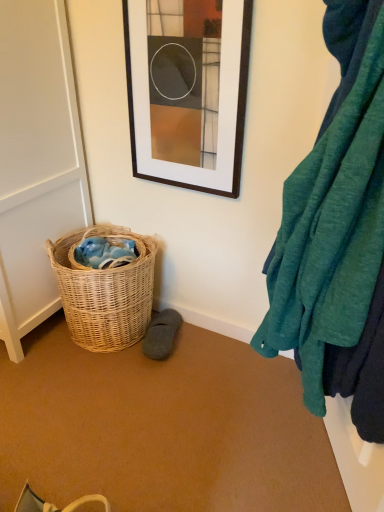
Find the location of a particular element. This screenshot has width=384, height=512. white matte screen door at left is located at coordinates (36, 161).

You are a GUI agent. You are given a task and a screenshot of the screen. Output one action in this format:
    pyautogui.click(x=<x>, y=<y>)
    Task: Click on the matte black picture frame at upper center
    The image size is (384, 512).
    Given the screenshot: What is the action you would take?
    pyautogui.click(x=188, y=90)

The image size is (384, 512). What are the coordinates of `gray suede slipper at lower center` in the screenshot? It's located at (161, 335).

Find the location of a particular element. The image size is (384, 512). teal soft fabric at right is located at coordinates (337, 234).

From the picture: From the image's perspective, is gray suede slipper at lower center over teal soft fabric at right?

Incorrect, from the image's perspective, gray suede slipper at lower center is lower than teal soft fabric at right.

Considering the positions of objects gray suede slipper at lower center and teal soft fabric at right in the image provided, who is more to the right, gray suede slipper at lower center or teal soft fabric at right?

Positioned to the right is teal soft fabric at right.

Considering the relative sizes of gray suede slipper at lower center and teal soft fabric at right in the image provided, is gray suede slipper at lower center taller than teal soft fabric at right?

Incorrect, the height of gray suede slipper at lower center is not larger of that of teal soft fabric at right.

Which object is closer to the camera taking this photo, gray suede slipper at lower center or teal soft fabric at right?

teal soft fabric at right is more forward.

Is white matte screen door at left not close to gray suede slipper at lower center?

No, white matte screen door at left is not far away from gray suede slipper at lower center.

Could you tell me if white matte screen door at left is facing gray suede slipper at lower center?

No, white matte screen door at left does not turn towards gray suede slipper at lower center.

Is white matte screen door at left to the left or to the right of gray suede slipper at lower center in the image?

Clearly, white matte screen door at left is on the left of gray suede slipper at lower center in the image.

From the image's perspective, which is above, woven natural basket at lower left or teal soft fabric at right?

From the image's view, teal soft fabric at right is above.

Does woven natural basket at lower left turn towards teal soft fabric at right?

No, woven natural basket at lower left is not facing towards teal soft fabric at right.

Is woven natural basket at lower left outside of teal soft fabric at right?

Absolutely, woven natural basket at lower left is external to teal soft fabric at right.

In the scene shown: How distant is woven natural basket at lower left from teal soft fabric at right?

woven natural basket at lower left is 35.89 inches away from teal soft fabric at right.

Is teal soft fabric at right aimed at woven natural basket at lower left?

No, teal soft fabric at right is not aimed at woven natural basket at lower left.

Considering the points (291, 333) and (122, 298), which point is behind, point (291, 333) or point (122, 298)?

The point (122, 298) is farther from the camera.

Is teal soft fabric at right inside or outside of woven natural basket at lower left?

teal soft fabric at right is not inside woven natural basket at lower left, it's outside.

Is teal soft fabric at right placed right next to woven natural basket at lower left?

teal soft fabric at right and woven natural basket at lower left are not in contact.

Are white matte screen door at left and matte black picture frame at upper center making contact?

white matte screen door at left and matte black picture frame at upper center are clearly separated.

Considering the relative sizes of white matte screen door at left and matte black picture frame at upper center in the image provided, is white matte screen door at left bigger than matte black picture frame at upper center?

Correct, white matte screen door at left is larger in size than matte black picture frame at upper center.

What's the angular difference between white matte screen door at left and matte black picture frame at upper center's facing directions?

0.258 degrees separate the facing orientations of white matte screen door at left and matte black picture frame at upper center.

From the image's perspective, is white matte screen door at left above or below matte black picture frame at upper center?

white matte screen door at left is situated lower than matte black picture frame at upper center in the image.

Which of these two, white matte screen door at left or woven natural basket at lower left, is bigger?

Bigger between the two is white matte screen door at left.

From a real-world perspective, is white matte screen door at left above or below woven natural basket at lower left?

In terms of real-world spatial position, white matte screen door at left is above woven natural basket at lower left.

Would you say white matte screen door at left contains woven natural basket at lower left?

Actually, woven natural basket at lower left is outside white matte screen door at left.

Between teal soft fabric at right and matte black picture frame at upper center, which one has less height?

matte black picture frame at upper center is shorter.

From the image's perspective, between teal soft fabric at right and matte black picture frame at upper center, which one is located above?

matte black picture frame at upper center, from the image's perspective.

Identify the location of shoe that is under the teal soft fabric at right (from a real-world perspective). (161, 335).

The image size is (384, 512). I want to click on shoe behind the white matte screen door at left, so click(x=161, y=335).

Estimate the real-world distances between objects in this image. Which object is closer to white matte screen door at left, gray suede slipper at lower center or teal soft fabric at right?

Among the two, gray suede slipper at lower center is located nearer to white matte screen door at left.

When comparing their distances from matte black picture frame at upper center, does gray suede slipper at lower center or woven natural basket at lower left seem further?

gray suede slipper at lower center is further to matte black picture frame at upper center.

Estimate the real-world distances between objects in this image. Which object is closer to gray suede slipper at lower center, matte black picture frame at upper center or white matte screen door at left?

white matte screen door at left is closer to gray suede slipper at lower center.

Consider the image. When comparing their distances from woven natural basket at lower left, does white matte screen door at left or matte black picture frame at upper center seem closer?

Among the two, white matte screen door at left is located nearer to woven natural basket at lower left.

When comparing their distances from teal soft fabric at right, does matte black picture frame at upper center or woven natural basket at lower left seem closer?

matte black picture frame at upper center lies closer to teal soft fabric at right than the other object.

Which object lies further to the anchor point gray suede slipper at lower center, woven natural basket at lower left or matte black picture frame at upper center?

Based on the image, matte black picture frame at upper center appears to be further to gray suede slipper at lower center.

From the image, which object appears to be farther from teal soft fabric at right, matte black picture frame at upper center or white matte screen door at left?

white matte screen door at left.

Based on their spatial positions, is white matte screen door at left or teal soft fabric at right closer to woven natural basket at lower left?

white matte screen door at left is positioned closer to the anchor woven natural basket at lower left.

Find the location of `picture frame between teal soft fabric at right and gray suede slipper at lower center in the front-back direction`. picture frame between teal soft fabric at right and gray suede slipper at lower center in the front-back direction is located at coordinates (188, 90).

Locate an element on the screen. This screenshot has height=512, width=384. picnic basket located between white matte screen door at left and gray suede slipper at lower center in the left-right direction is located at coordinates (105, 291).

Identify the location of shoe between white matte screen door at left and matte black picture frame at upper center in the horizontal direction. The image size is (384, 512). (161, 335).

At what (x,y) coordinates should I click in order to perform the action: click on shoe between white matte screen door at left and teal soft fabric at right in the horizontal direction. Please return your answer as a coordinate pair (x, y). The height and width of the screenshot is (512, 384). Looking at the image, I should click on (161, 335).